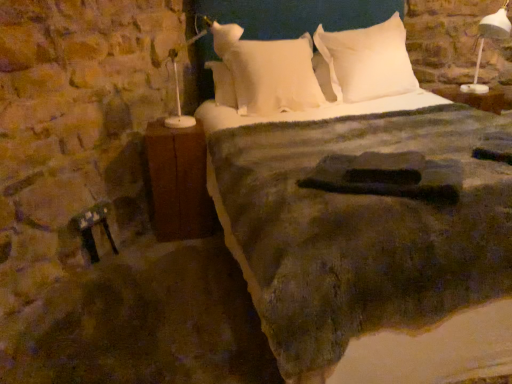
Describe the element at coordinates (483, 44) in the screenshot. I see `white plastic lamp at upper right` at that location.

Locate an element on the screen. The height and width of the screenshot is (384, 512). textured woolen blanket at center is located at coordinates (361, 209).

I want to click on white soft pillow at center, which is the 1th pillow in left-to-right order, so click(263, 73).

From a real-world perspective, is white plastic lamp at upper right physically above white soft pillow at upper center, which is the 1th pillow in right-to-left order?

Yes.

In the scene shown: Is white plastic lamp at upper right to the left of white soft pillow at upper center, which is the 1th pillow in right-to-left order, from the viewer's perspective?

No, white plastic lamp at upper right is not to the left of white soft pillow at upper center, which is the 1th pillow in right-to-left order.

Does point (478, 32) come closer to viewer compared to point (351, 38)?

No, (478, 32) is behind (351, 38).

Does white soft pillow at center, which is the 1th pillow in left-to-right order, have a greater height compared to textured woolen blanket at center?

Incorrect, the height of white soft pillow at center, which is the 1th pillow in left-to-right order, is not larger of that of textured woolen blanket at center.

Does white soft pillow at center, the 2th pillow positioned from the right, appear on the left side of textured woolen blanket at center?

Indeed, white soft pillow at center, the 2th pillow positioned from the right, is positioned on the left side of textured woolen blanket at center.

Does white soft pillow at center, the 2th pillow positioned from the right, turn towards textured woolen blanket at center?

Yes, white soft pillow at center, the 2th pillow positioned from the right, faces towards textured woolen blanket at center.

Is there a large distance between white soft pillow at center, the 2th pillow positioned from the right, and textured woolen blanket at center?

That's not correct — white soft pillow at center, the 2th pillow positioned from the right, is a little close to textured woolen blanket at center.

Can you confirm if white soft pillow at upper center, which is the 1th pillow in right-to-left order, is taller than brown wood nightstand at left?

Incorrect, the height of white soft pillow at upper center, which is the 1th pillow in right-to-left order, is not larger of that of brown wood nightstand at left.

Is white soft pillow at upper center, which is the 1th pillow in right-to-left order, positioned beyond the bounds of brown wood nightstand at left?

Yes.

At what (x,y) coordinates should I click in order to perform the action: click on nightstand in front of the white soft pillow at center, which is the 1th pillow in left-to-right order. Please return your answer as a coordinate pair (x, y). The image size is (512, 384). Looking at the image, I should click on point(178,182).

Considering the sizes of objects brown wood nightstand at left and white soft pillow at center, the 2th pillow positioned from the right, in the image provided, who is wider, brown wood nightstand at left or white soft pillow at center, the 2th pillow positioned from the right,?

With larger width is white soft pillow at center, the 2th pillow positioned from the right.

Could you tell me if brown wood nightstand at left is facing white soft pillow at center, which is the 1th pillow in left-to-right order?

No, brown wood nightstand at left is not facing towards white soft pillow at center, which is the 1th pillow in left-to-right order.

Between brown wood nightstand at left and white soft pillow at center, the 2th pillow positioned from the right, which one appears on the left side from the viewer's perspective?

brown wood nightstand at left.

Looking at their sizes, would you say textured woolen blanket at center is wider or thinner than white soft pillow at center, which is the 1th pillow in left-to-right order?

Considering their sizes, textured woolen blanket at center looks broader than white soft pillow at center, which is the 1th pillow in left-to-right order.

Which is behind, point (406, 196) or point (251, 98)?

Point (251, 98)

Looking at this image, between textured woolen blanket at center and white soft pillow at center, the 2th pillow positioned from the right, which one has larger size?

With larger size is textured woolen blanket at center.

From the image's perspective, which object appears higher, textured woolen blanket at center or white soft pillow at center, which is the 1th pillow in left-to-right order?

From the image's view, white soft pillow at center, which is the 1th pillow in left-to-right order, is above.

Can white soft pillow at upper center, which is the 1th pillow in right-to-left order, be found inside brown wood nightstand at left?

No, white soft pillow at upper center, which is the 1th pillow in right-to-left order, is located outside of brown wood nightstand at left.

How distant is brown wood nightstand at left from white soft pillow at upper center, which is the 1th pillow in right-to-left order?

They are 3.88 feet apart.

From the image's perspective, who appears lower, brown wood nightstand at left or white soft pillow at upper center, which is the 1th pillow in right-to-left order?

brown wood nightstand at left appears lower in the image.

The height and width of the screenshot is (384, 512). What are the coordinates of `nightstand below the white plastic lamp at upper right (from a real-world perspective)` in the screenshot? It's located at click(178, 182).

From their relative heights in the image, would you say brown wood nightstand at left is taller or shorter than white plastic lamp at upper right?

Clearly, brown wood nightstand at left is taller compared to white plastic lamp at upper right.

Is brown wood nightstand at left wider than white plastic lamp at upper right?

No, brown wood nightstand at left is not wider than white plastic lamp at upper right.

At what (x,y) coordinates should I click in order to perform the action: click on pillow above the white plastic lamp at upper right (from the image's perspective). Please return your answer as a coordinate pair (x, y). Looking at the image, I should click on (364, 62).

Locate an element on the screen. Image resolution: width=512 pixels, height=384 pixels. bed on the right of white soft pillow at center, the 2th pillow positioned from the right is located at coordinates (361, 209).

Considering their positions, is white soft pillow at upper center, which is the 1th pillow in right-to-left order, positioned closer to white plastic lamp at upper right than textured woolen blanket at center?

Based on the image, white soft pillow at upper center, which is the 1th pillow in right-to-left order, appears to be nearer to white plastic lamp at upper right.

Considering their positions, is brown wood nightstand at left positioned closer to textured woolen blanket at center than white soft pillow at center, which is the 1th pillow in left-to-right order?

brown wood nightstand at left is closer to textured woolen blanket at center.

Looking at the image, which one is located closer to white soft pillow at upper center, the second pillow when ordered from left to right, textured woolen blanket at center or white soft pillow at center, the 2th pillow positioned from the right?

white soft pillow at center, the 2th pillow positioned from the right.

Which object lies nearer to the anchor point white plastic lamp at upper right, brown wood nightstand at left or white soft pillow at upper center, which is the 1th pillow in right-to-left order?

white soft pillow at upper center, which is the 1th pillow in right-to-left order, lies closer to white plastic lamp at upper right than the other object.

From the image, which object appears to be farther from white plastic lamp at upper right, white soft pillow at center, the 2th pillow positioned from the right, or white soft pillow at upper center, the second pillow when ordered from left to right?

white soft pillow at center, the 2th pillow positioned from the right.

Estimate the real-world distances between objects in this image. Which object is further from textured woolen blanket at center, white soft pillow at center, the 2th pillow positioned from the right, or white plastic lamp at upper right?

white plastic lamp at upper right is further to textured woolen blanket at center.

Looking at the image, which one is located further to white plastic lamp at upper right, textured woolen blanket at center or brown wood nightstand at left?

brown wood nightstand at left.

From the image, which object appears to be nearer to white soft pillow at upper center, the second pillow when ordered from left to right, brown wood nightstand at left or textured woolen blanket at center?

textured woolen blanket at center is positioned closer to the anchor white soft pillow at upper center, the second pillow when ordered from left to right.

The height and width of the screenshot is (384, 512). What are the coordinates of `pillow between brown wood nightstand at left and white soft pillow at upper center, the second pillow when ordered from left to right, in the horizontal direction` in the screenshot? It's located at (263, 73).

Find the location of a particular element. Image resolution: width=512 pixels, height=384 pixels. pillow between white soft pillow at center, the 2th pillow positioned from the right, and white plastic lamp at upper right is located at coordinates (364, 62).

The image size is (512, 384). I want to click on bedside lamp between textured woolen blanket at center and white soft pillow at upper center, which is the 1th pillow in right-to-left order, in the front-back direction, so click(483, 44).

Locate an element on the screen. This screenshot has height=384, width=512. nightstand between textured woolen blanket at center and white soft pillow at center, the 2th pillow positioned from the right, in the front-back direction is located at coordinates (178, 182).